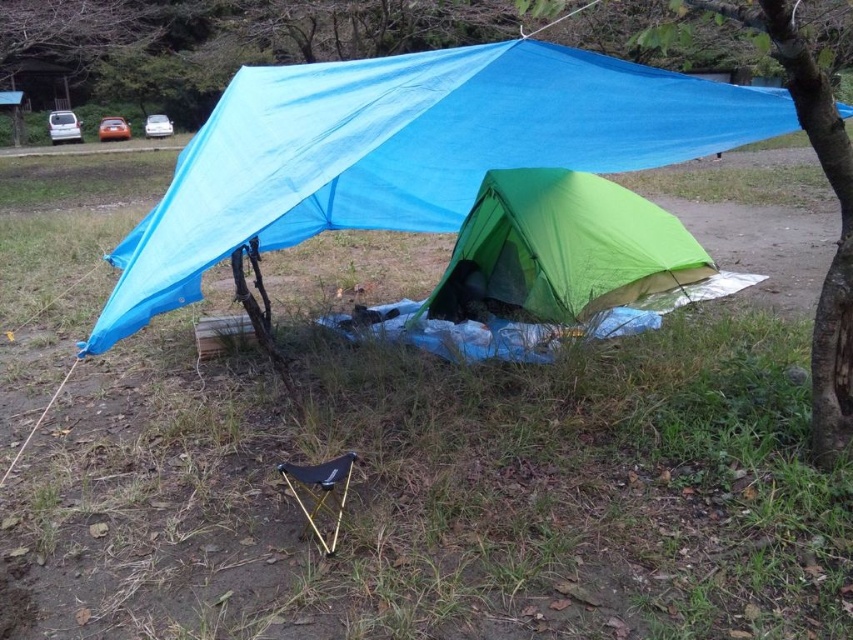
Does green fabric tent at center appear under green fabric tent at lower right?

Yes, green fabric tent at center is below green fabric tent at lower right.

What do you see at coordinates (567, 248) in the screenshot? I see `green fabric tent at center` at bounding box center [567, 248].

Locate an element on the screen. This screenshot has height=640, width=853. green fabric tent at center is located at coordinates (567, 248).

Does blue tarp at upper center have a smaller size compared to green fabric tent at lower right?

No, blue tarp at upper center is not smaller than green fabric tent at lower right.

Which is behind, point (527, 120) or point (814, 397)?

The point (527, 120) is more distant.

Based on the photo, who is more distant from viewer, (341,212) or (827,160)?

The point (341,212) is more distant.

Image resolution: width=853 pixels, height=640 pixels. In order to click on blue tarp at upper center in this screenshot , I will do point(407,150).

Who is shorter, blue tarp at upper center or green fabric tent at center?

green fabric tent at center is shorter.

The height and width of the screenshot is (640, 853). I want to click on blue tarp at upper center, so click(407, 150).

Identify the location of blue tarp at upper center. (407, 150).